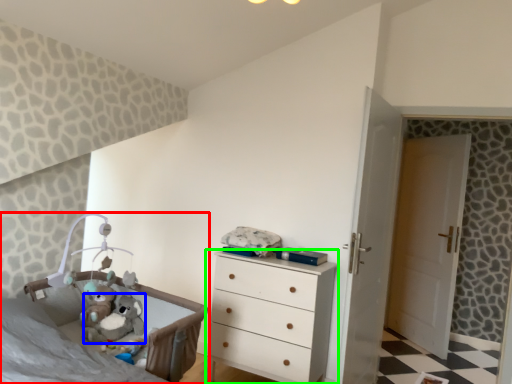
Question: Based on their relative distances, which object is nearer to infant bed (highlighted by a red box)? Choose from animal (highlighted by a blue box) and chest of drawers (highlighted by a green box).

Choices:
 (A) animal
 (B) chest of drawers

Answer: (A)